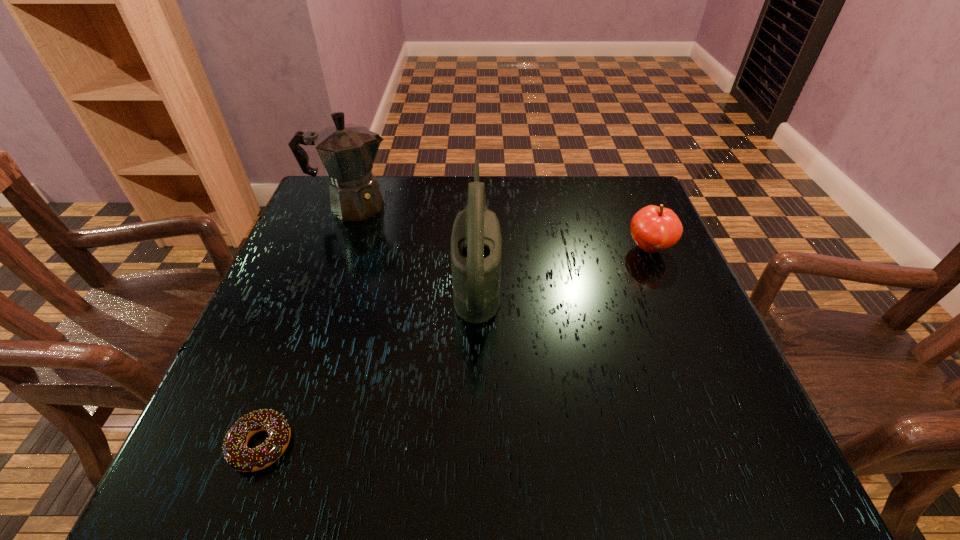
The width and height of the screenshot is (960, 540). Find the location of `vacant space that satisfies the following two spatial constraints: 1. on the front side of the apple; 2. on the spout of the third object from left to right`. vacant space that satisfies the following two spatial constraints: 1. on the front side of the apple; 2. on the spout of the third object from left to right is located at coordinates (661, 276).

Where is `free location that satisfies the following two spatial constraints: 1. on the pouring side of the coffeepot; 2. on the left side of the apple`? free location that satisfies the following two spatial constraints: 1. on the pouring side of the coffeepot; 2. on the left side of the apple is located at coordinates (337, 248).

The width and height of the screenshot is (960, 540). In order to click on free spot that satisfies the following two spatial constraints: 1. on the pouring side of the coffeepot; 2. on the right side of the second shortest object in this screenshot , I will do `click(337, 248)`.

The image size is (960, 540). I want to click on free point that satisfies the following two spatial constraints: 1. on the back side of the rightmost object; 2. on the right side of the doughnut, so click(x=333, y=248).